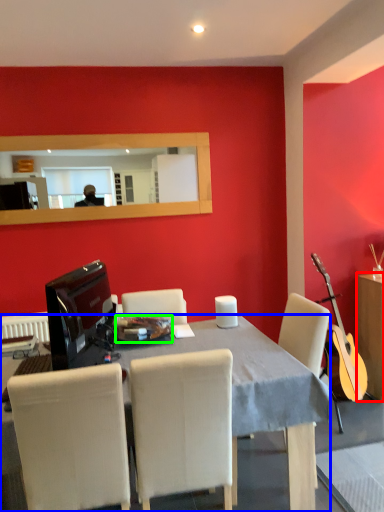
Question: Considering the real-world distances, which object is closest to cabinetry (highlighted by a red box)? desk (highlighted by a blue box) or plate (highlighted by a green box).

Choices:
 (A) desk
 (B) plate

Answer: (A)